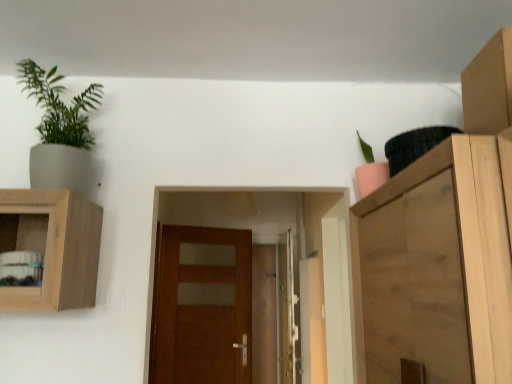
Question: Visually, is wooden cabinet at right positioned to the left or to the right of brown wooden door at center, which ranks as the 1th door in front-to-back order?

Choices:
 (A) left
 (B) right

Answer: (B)

Question: In terms of size, does wooden cabinet at right appear bigger or smaller than brown wooden door at center, which ranks as the 1th door in front-to-back order?

Choices:
 (A) big
 (B) small

Answer: (A)

Question: Based on their relative distances, which object is farther from the pink matte pot at upper right, the first houseplant viewed from the right?

Choices:
 (A) matte gray pot at upper left, the second houseplant from the right
 (B) cardboard box at upper right
 (C) brown wooden door at center, which appears as the 1th door when viewed from the back
 (D) wooden cabinet at right
 (E) brown wooden door at center, which ranks as the 1th door in front-to-back order

Answer: (C)

Question: Which is nearer to the matte gray pot at upper left, marked as the first houseplant in a left-to-right arrangement?

Choices:
 (A) brown wooden door at center, the 2th door viewed from the back
 (B) brown wooden door at center, positioned as the 2th door in front-to-back order
 (C) wooden cabinet at right
 (D) cardboard box at upper right
 (E) pink matte pot at upper right, the 2th houseplant when ordered from left to right

Answer: (E)